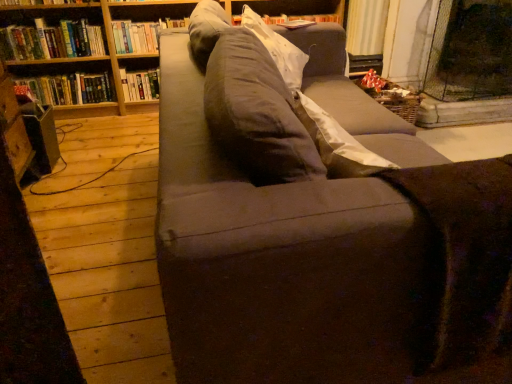
Question: Should I look upward or downward to see hardcover book at upper left, the third book viewed from the right?

Choices:
 (A) down
 (B) up

Answer: (B)

Question: From the image's perspective, is hardcover book at upper left, which is the 1th book in right-to-left order, on top of gray fabric pillow at upper center?

Choices:
 (A) no
 (B) yes

Answer: (B)

Question: Is hardcover book at upper left, which is the fourth book from left to right, shorter than gray fabric pillow at upper center?

Choices:
 (A) yes
 (B) no

Answer: (A)

Question: Could you tell me if hardcover book at upper left, which is the 1th book in right-to-left order, is turned towards gray fabric pillow at upper center?

Choices:
 (A) yes
 (B) no

Answer: (A)

Question: Is hardcover book at upper left, which is the fourth book from left to right, beside gray fabric pillow at upper center?

Choices:
 (A) no
 (B) yes

Answer: (A)

Question: Can you confirm if hardcover book at upper left, which is the fourth book from left to right, is taller than gray fabric pillow at upper center?

Choices:
 (A) yes
 (B) no

Answer: (B)

Question: From a real-world perspective, is hardcover book at upper left, which is the 1th book in right-to-left order, on gray fabric pillow at upper center?

Choices:
 (A) yes
 (B) no

Answer: (B)

Question: From the image's perspective, is wooden bookcase at upper left located beneath gray fabric pillow at upper center?

Choices:
 (A) no
 (B) yes

Answer: (A)

Question: Is there a large distance between wooden bookcase at upper left and gray fabric pillow at upper center?

Choices:
 (A) no
 (B) yes

Answer: (B)

Question: Does wooden bookcase at upper left contain gray fabric pillow at upper center?

Choices:
 (A) yes
 (B) no

Answer: (B)

Question: Is wooden bookcase at upper left facing towards gray fabric pillow at upper center?

Choices:
 (A) no
 (B) yes

Answer: (B)

Question: Is wooden bookcase at upper left smaller than gray fabric pillow at upper center?

Choices:
 (A) no
 (B) yes

Answer: (A)

Question: Does wooden bookcase at upper left appear on the left side of gray fabric pillow at upper center?

Choices:
 (A) yes
 (B) no

Answer: (A)

Question: Considering the relative sizes of hardcover book at upper left, the third book viewed from the right, and hardcover book at upper left, the third book in the left-to-right sequence, in the image provided, is hardcover book at upper left, the third book viewed from the right, shorter than hardcover book at upper left, the third book in the left-to-right sequence,?

Choices:
 (A) no
 (B) yes

Answer: (A)